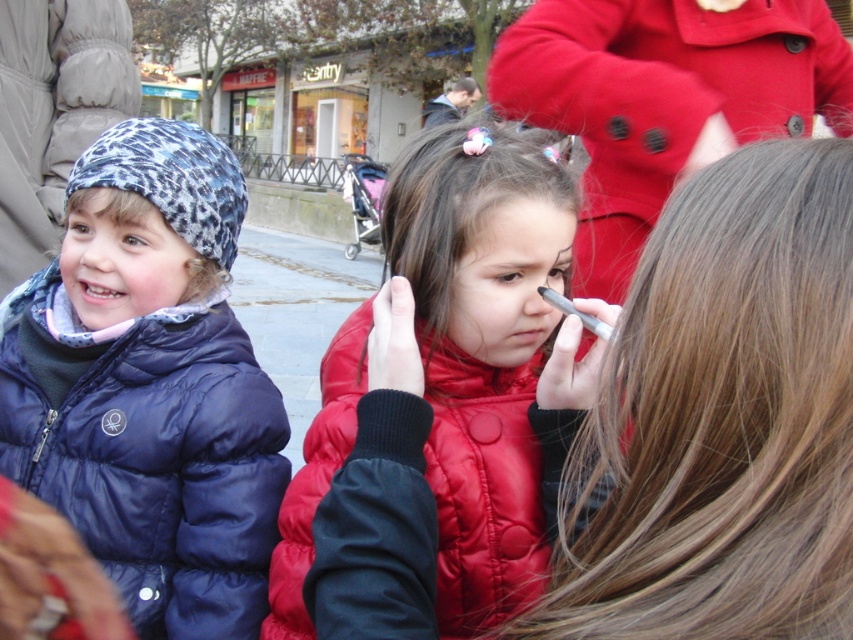
Between point (207, 132) and point (643, 1), which one is positioned behind?

The point (643, 1) is more distant.

Is point (274, 502) farther from camera compared to point (646, 157)?

No, (274, 502) is in front of (646, 157).

The height and width of the screenshot is (640, 853). What are the coordinates of `matte blue puffer jacket at left` in the screenshot? It's located at (149, 385).

Which is above, shiny red jacket at center or matte red coat at center?

Positioned higher is matte red coat at center.

This screenshot has width=853, height=640. What do you see at coordinates (442, 404) in the screenshot?
I see `shiny red jacket at center` at bounding box center [442, 404].

Identify the location of shiny red jacket at center. (442, 404).

Where is `shiny red jacket at center`? The image size is (853, 640). shiny red jacket at center is located at coordinates (442, 404).

Does shiny red jacket at center appear under matte blue puffer jacket at left?

Yes, shiny red jacket at center is below matte blue puffer jacket at left.

From the picture: Between shiny red jacket at center and matte blue puffer jacket at left, which one is positioned lower?

shiny red jacket at center

At what (x,y) coordinates should I click in order to perform the action: click on shiny red jacket at center. Please return your answer as a coordinate pair (x, y). The image size is (853, 640). Looking at the image, I should click on (442, 404).

Image resolution: width=853 pixels, height=640 pixels. Identify the location of shiny red jacket at center. (442, 404).